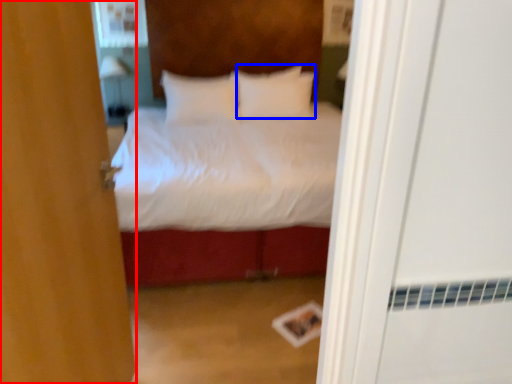
Question: Among these objects, which one is farthest to the camera, door (highlighted by a red box) or pillow (highlighted by a blue box)?

Choices:
 (A) door
 (B) pillow

Answer: (B)